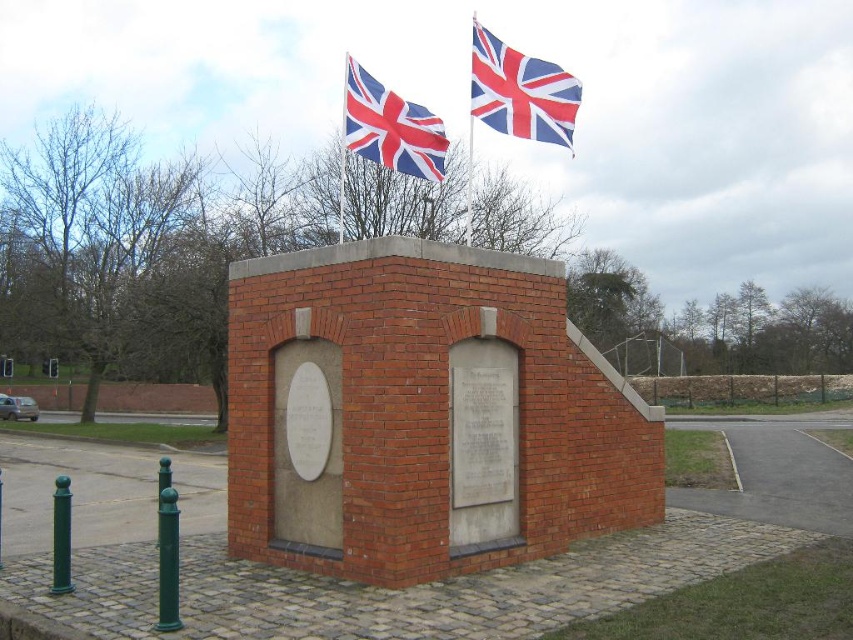
Question: Which point is closer to the camera?

Choices:
 (A) (434, 170)
 (B) (492, 106)

Answer: (B)

Question: Is matte fabric flag at upper center smaller than red and white fabric flag at upper center?

Choices:
 (A) no
 (B) yes

Answer: (B)

Question: Does matte fabric flag at upper center appear over red and white fabric flag at upper center?

Choices:
 (A) yes
 (B) no

Answer: (A)

Question: Does matte fabric flag at upper center appear under red and white fabric flag at upper center?

Choices:
 (A) no
 (B) yes

Answer: (A)